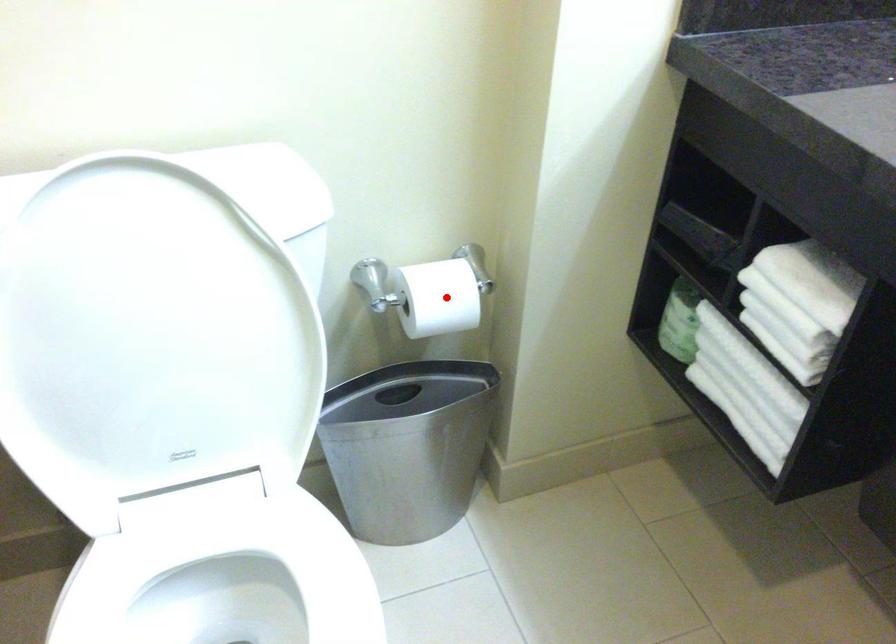
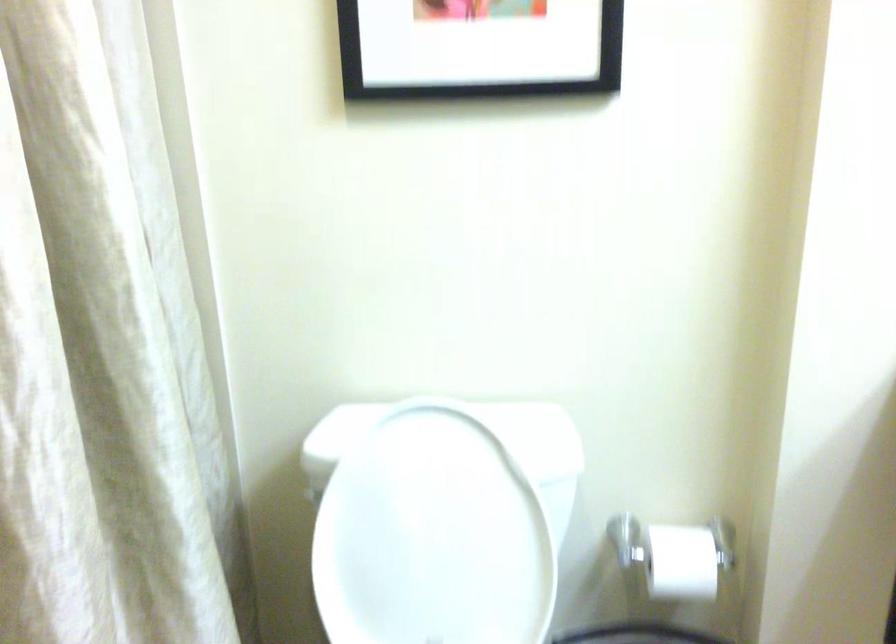
Find the pixel in the second image that matches the highlighted location in the first image.

(682, 562)